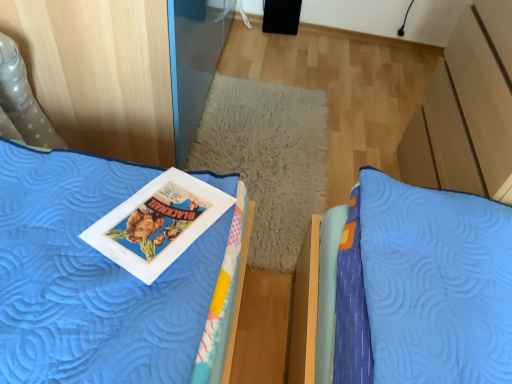
Question: From the image's perspective, is blue quilted bed at upper left located above or below blue quilted pillow at center?

Choices:
 (A) above
 (B) below

Answer: (B)

Question: Based on their sizes in the image, would you say blue quilted bed at upper left is bigger or smaller than blue quilted pillow at center?

Choices:
 (A) small
 (B) big

Answer: (B)

Question: Which object is the closest to the matte paper comic book at center-left?

Choices:
 (A) blue quilted pillow at center
 (B) blue quilted bed at upper left

Answer: (B)

Question: Based on their relative distances, which object is nearer to the blue quilted bed at upper left?

Choices:
 (A) matte paper comic book at center-left
 (B) blue quilted pillow at center

Answer: (A)